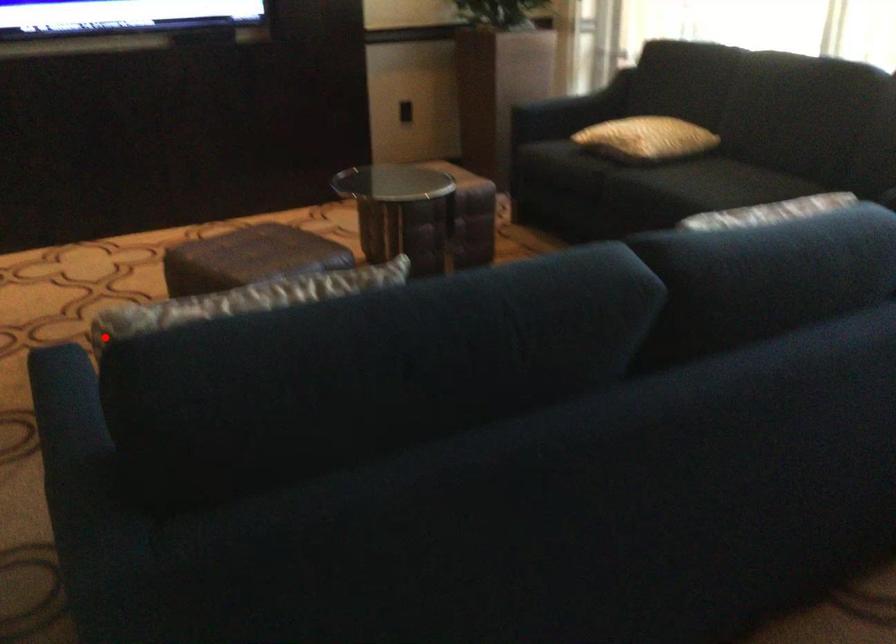
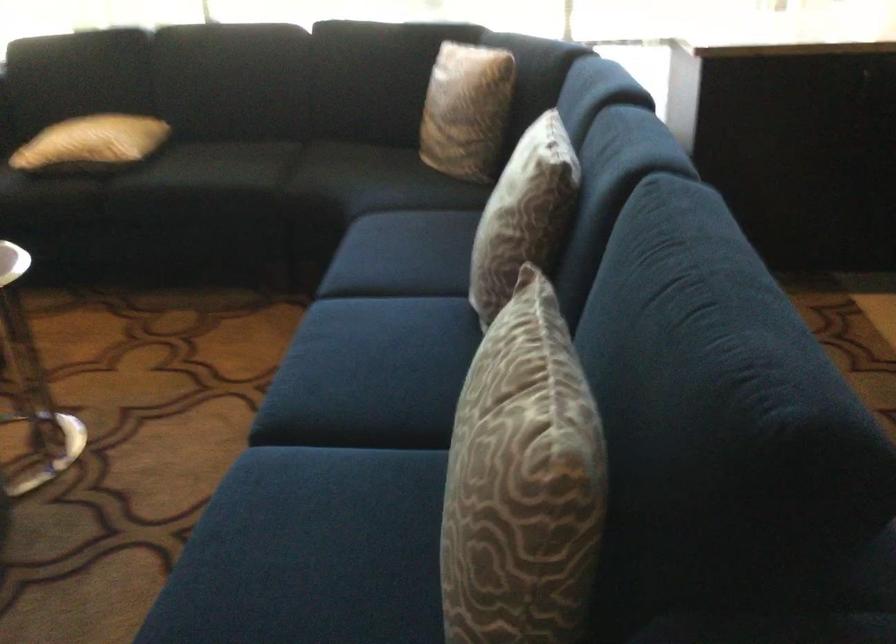
The point at the highlighted location is marked in the first image. Where is the corresponding point in the second image?

(522, 482)